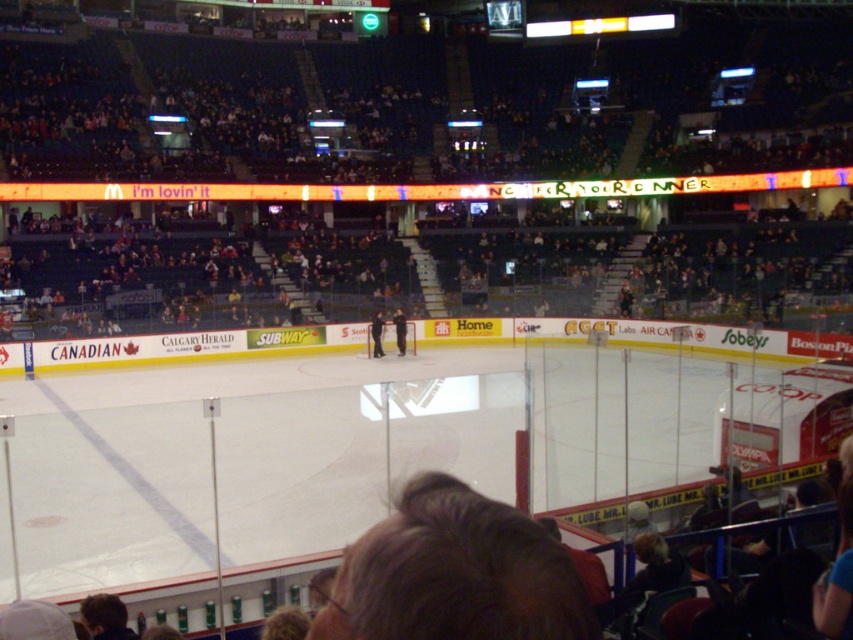
Question: Is brown hair at center closer to camera compared to dark blue uniform at center?

Choices:
 (A) no
 (B) yes

Answer: (B)

Question: Among these objects, which one is nearest to the camera?

Choices:
 (A) dark blue uniform at center
 (B) black smooth hockey stick at center

Answer: (B)

Question: Which object is closer to the camera taking this photo?

Choices:
 (A) brown hair at center
 (B) black smooth hockey stick at center
 (C) dark blue seats at upper center
 (D) dark blue uniform at center

Answer: (A)

Question: Can you confirm if brown hair at center is positioned below dark blue uniform at center?

Choices:
 (A) no
 (B) yes

Answer: (A)

Question: Which point is closer to the camera taking this photo?

Choices:
 (A) (372, 336)
 (B) (165, 72)

Answer: (A)

Question: Is brown hair at center smaller than dark blue uniform at center?

Choices:
 (A) no
 (B) yes

Answer: (B)